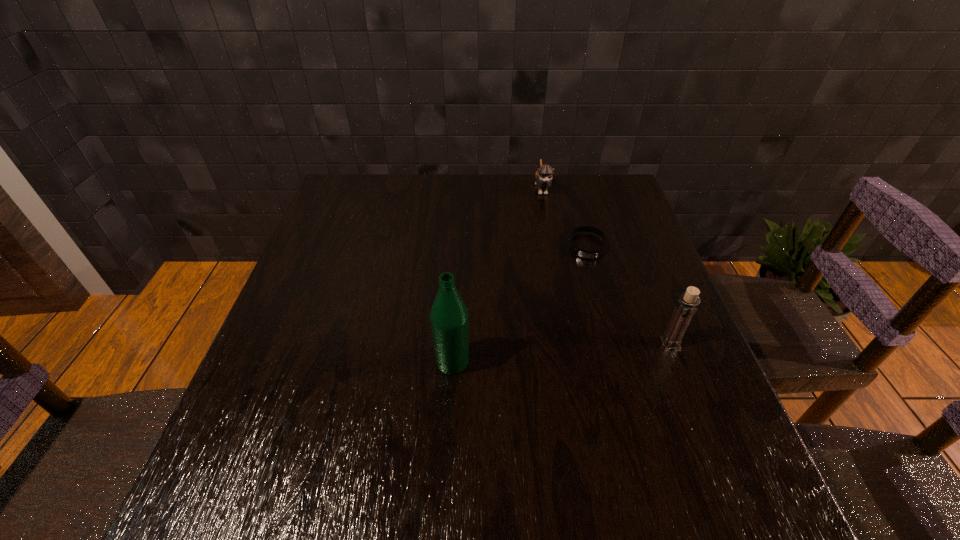
The image size is (960, 540). Identify the location of vacant space on the desktop that is between the tallest object and the rightmost object and is positioned on the display of the second farthest object. click(x=588, y=350).

Where is `vacant space on the desktop that is between the leftmost object and the candle holder and is positioned on the front-facing side of the second object from left to right`? The width and height of the screenshot is (960, 540). vacant space on the desktop that is between the leftmost object and the candle holder and is positioned on the front-facing side of the second object from left to right is located at coordinates (576, 352).